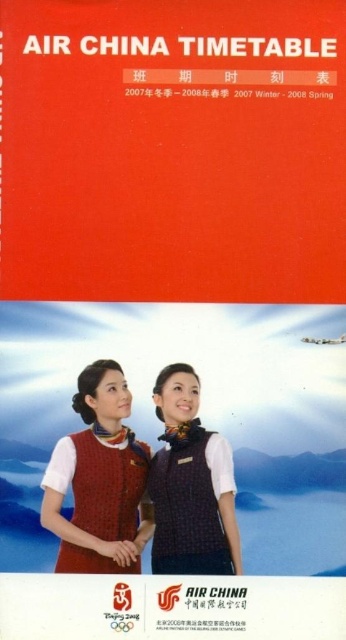
Does knitted sweater at center have a greater width compared to plaid fabric vest at center?

Yes, knitted sweater at center is wider than plaid fabric vest at center.

Who is more forward, (125, 570) or (173, 531)?

Point (125, 570) is more forward.

Based on the photo, who is more forward, (83, 387) or (175, 557)?

Point (175, 557) is in front.

Where is `knitted sweater at center`? Image resolution: width=346 pixels, height=640 pixels. knitted sweater at center is located at coordinates (98, 480).